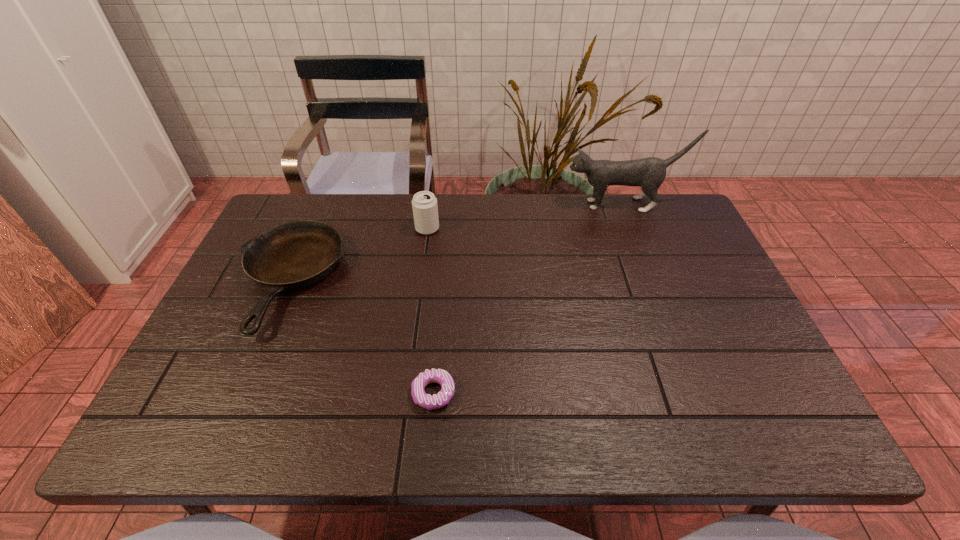
Identify the location of free space located 0.050m on the left of the can. The image size is (960, 540). (399, 228).

The image size is (960, 540). In order to click on vacant space situated on the back of the frying pan in this screenshot , I will do pyautogui.click(x=315, y=222).

Where is `vacant area situated 0.230m on the back of the shortest object`? The width and height of the screenshot is (960, 540). vacant area situated 0.230m on the back of the shortest object is located at coordinates (442, 299).

Image resolution: width=960 pixels, height=540 pixels. Find the location of `cat located at the far edge`. cat located at the far edge is located at coordinates (649, 173).

Locate an element on the screen. can situated at the far edge is located at coordinates (424, 204).

Where is `frying pan present at the far edge`? This screenshot has height=540, width=960. frying pan present at the far edge is located at coordinates (294, 255).

Locate an element on the screen. This screenshot has height=540, width=960. object that is positioned at the near edge is located at coordinates (442, 377).

Find the location of a particular element. The width and height of the screenshot is (960, 540). object that is positioned at the left edge is located at coordinates (294, 255).

Identify the location of object positioned at the right edge. (649, 173).

Where is `object that is at the far left corner`? The height and width of the screenshot is (540, 960). object that is at the far left corner is located at coordinates (294, 255).